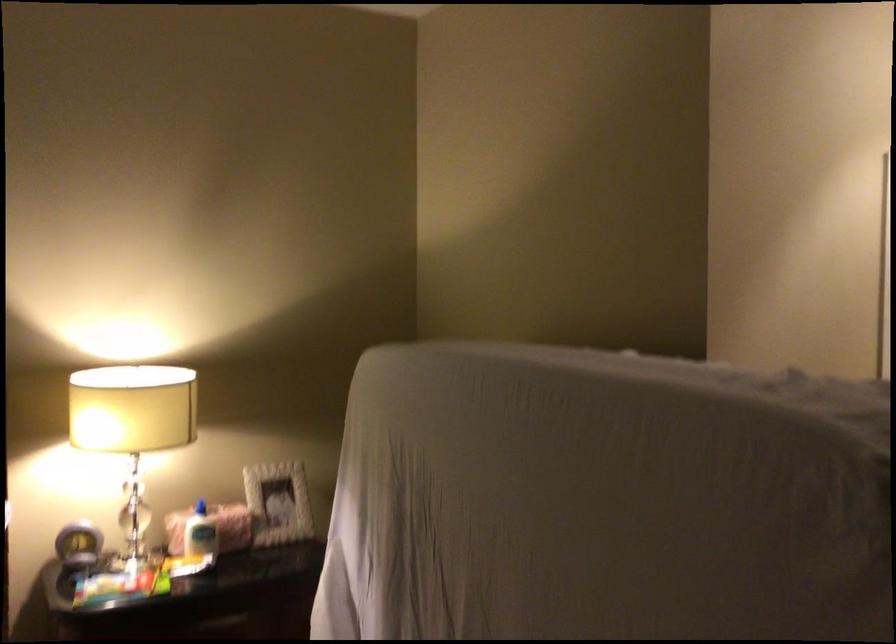
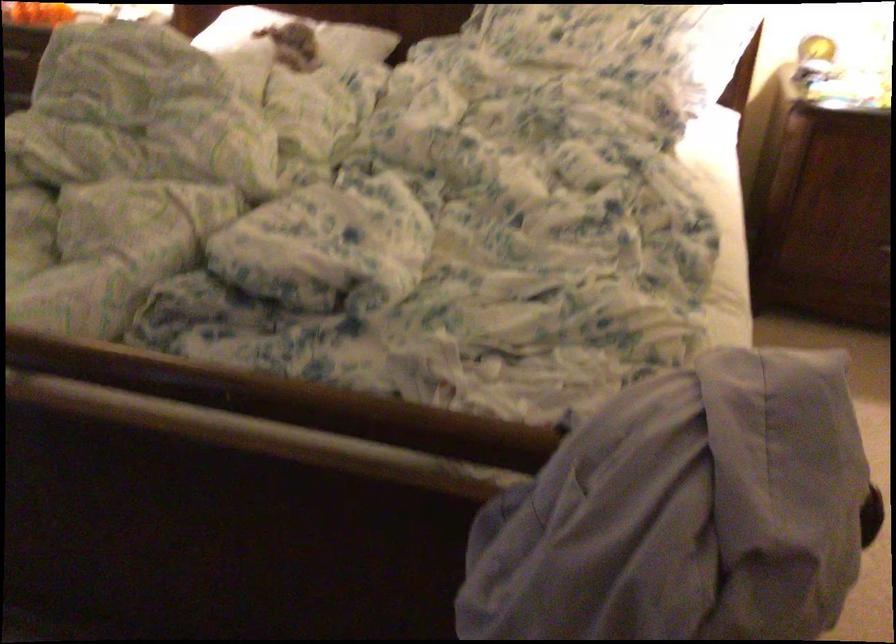
How did the camera likely rotate?

The camera's rotation is toward left-down.